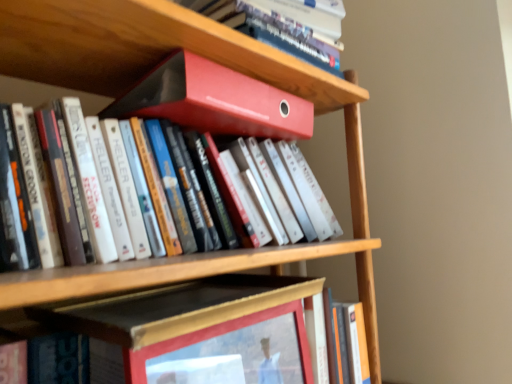
Describe the element at coordinates (143, 48) in the screenshot. This screenshot has width=512, height=384. I see `matte plastic file at upper center` at that location.

This screenshot has height=384, width=512. What do you see at coordinates (269, 30) in the screenshot?
I see `matte red folder at upper center, which is the fifth book from bottom to top` at bounding box center [269, 30].

Describe the element at coordinates (230, 352) in the screenshot. This screenshot has width=512, height=384. I see `wooden picture frame at center` at that location.

What is the approximate height of wooden picture frame at center?

wooden picture frame at center is 9.51 inches in height.

In order to click on matte red binder at upper center, arranged as the second book when viewed from the top in this screenshot , I will do `click(215, 101)`.

From a real-world perspective, which object rests below the other?

matte plastic file at upper center, from a real-world perspective.

Considering the sizes of objects matte red folder at upper center, which is the fifth book from bottom to top, and matte plastic file at upper center in the image provided, who is wider, matte red folder at upper center, which is the fifth book from bottom to top, or matte plastic file at upper center?

Wider between the two is matte red folder at upper center, which is the fifth book from bottom to top.

Which object is more forward, matte red folder at upper center, which is the fifth book from bottom to top, or matte plastic file at upper center?

matte plastic file at upper center is closer to the camera.

Is matte plastic file at upper center oriented away from matte red binder at upper center, the 3th book viewed from the top?

That's not correct — matte plastic file at upper center is not looking away from matte red binder at upper center, the 3th book viewed from the top.

Can you confirm if matte plastic file at upper center is thinner than matte red binder at upper center, the third book in the bottom-to-top sequence?

In fact, matte plastic file at upper center might be wider than matte red binder at upper center, the third book in the bottom-to-top sequence.

Who is shorter, matte plastic file at upper center or matte red binder at upper center, the 3th book viewed from the top?

matte plastic file at upper center.

Is matte plastic file at upper center outside of matte red binder at upper center, the third book in the bottom-to-top sequence?

matte plastic file at upper center lies outside matte red binder at upper center, the third book in the bottom-to-top sequence,'s area.

Based on their positions, is matte red binder at upper center, the 3th book viewed from the top, located to the left or right of matte red binder at upper center, arranged as the second book when viewed from the top?

matte red binder at upper center, the 3th book viewed from the top, is positioned on matte red binder at upper center, arranged as the second book when viewed from the top,'s left side.

Is matte red binder at upper center, the third book in the bottom-to-top sequence, turned away from matte red binder at upper center, the 4th book positioned from the bottom?

No.

Which of these two, matte red binder at upper center, the 3th book viewed from the top, or matte red binder at upper center, arranged as the second book when viewed from the top, is smaller?

matte red binder at upper center, arranged as the second book when viewed from the top, is smaller.

From the image's perspective, would you say matte red binder at upper center, the third book in the bottom-to-top sequence, is shown under matte red binder at upper center, arranged as the second book when viewed from the top?

Correct, matte red binder at upper center, the third book in the bottom-to-top sequence, appears lower than matte red binder at upper center, arranged as the second book when viewed from the top, in the image.

Is wooden picture frame at center aimed at matte red folder at upper center, which is the fifth book from bottom to top?

No.

Considering the positions of objects wooden picture frame at center and matte red folder at upper center, placed as the first book when sorted from top to bottom, in the image provided, who is in front, wooden picture frame at center or matte red folder at upper center, placed as the first book when sorted from top to bottom,?

wooden picture frame at center is closer to the camera.

Looking at their sizes, would you say wooden picture frame at center is wider or thinner than matte red folder at upper center, which is the fifth book from bottom to top?

wooden picture frame at center is thinner than matte red folder at upper center, which is the fifth book from bottom to top.

Between wooden picture frame at center and matte red folder at upper center, which is the fifth book from bottom to top, which one has more height?

Standing taller between the two is wooden picture frame at center.

Considering the positions of objects matte red binder at upper center, the 3th book viewed from the top, and matte plastic file at upper center in the image provided, who is more to the right, matte red binder at upper center, the 3th book viewed from the top, or matte plastic file at upper center?

Positioned to the right is matte plastic file at upper center.

From the image's perspective, which one is positioned lower, matte red binder at upper center, the 3th book viewed from the top, or matte plastic file at upper center?

matte red binder at upper center, the 3th book viewed from the top, from the image's perspective.

From a real-world perspective, is matte red binder at upper center, the third book in the bottom-to-top sequence, positioned above or below matte plastic file at upper center?

matte red binder at upper center, the third book in the bottom-to-top sequence, is situated lower than matte plastic file at upper center in the real world.

Is matte red binder at upper center, the third book in the bottom-to-top sequence, aimed at matte plastic file at upper center?

No, matte red binder at upper center, the third book in the bottom-to-top sequence, does not turn towards matte plastic file at upper center.

Can you see matte plastic file at upper center touching wooden picture frame at center?

matte plastic file at upper center is not next to wooden picture frame at center, and they're not touching.

Which of these two, matte plastic file at upper center or wooden picture frame at center, is wider?

Wider between the two is matte plastic file at upper center.

Is matte plastic file at upper center not inside wooden picture frame at center?

Indeed, matte plastic file at upper center is completely outside wooden picture frame at center.

Can you confirm if matte plastic file at upper center is smaller than wooden picture frame at center?

Incorrect, matte plastic file at upper center is not smaller in size than wooden picture frame at center.

Is matte red binder at upper center, the third book in the bottom-to-top sequence, closer to the viewer compared to orange matte book at lower right, which ranks as the first book in bottom-to-top order?

Yes, matte red binder at upper center, the third book in the bottom-to-top sequence, is closer to the viewer.

Is matte red binder at upper center, the 3th book viewed from the top, turned away from orange matte book at lower right, which ranks as the first book in bottom-to-top order?

matte red binder at upper center, the 3th book viewed from the top, does not have its back to orange matte book at lower right, which ranks as the first book in bottom-to-top order.

From a real-world perspective, is matte red binder at upper center, the third book in the bottom-to-top sequence, located higher than orange matte book at lower right, which ranks as the first book in bottom-to-top order?

Yes, from a real-world perspective, matte red binder at upper center, the third book in the bottom-to-top sequence, is over orange matte book at lower right, which ranks as the first book in bottom-to-top order

Identify the location of shelf below the matte red folder at upper center, which is the fifth book from bottom to top (from the image's perspective). (143, 48).

The image size is (512, 384). Identify the location of shelf behind the matte red binder at upper center, the third book in the bottom-to-top sequence. (143, 48).

Looking at the image, which one is located closer to wooden picture frame at center, matte red binder at upper center, arranged as the second book when viewed from the top, or matte black frame at center, the 4th book positioned from the top?

matte black frame at center, the 4th book positioned from the top.

Which object lies nearer to the anchor point matte plastic file at upper center, matte red binder at upper center, arranged as the second book when viewed from the top, or wooden picture frame at center?

matte red binder at upper center, arranged as the second book when viewed from the top.

When comparing their distances from matte black frame at center, the 4th book positioned from the top, does matte red binder at upper center, arranged as the second book when viewed from the top, or matte plastic file at upper center seem closer?

matte red binder at upper center, arranged as the second book when viewed from the top, is positioned closer to the anchor matte black frame at center, the 4th book positioned from the top.

Looking at the image, which one is located closer to matte red binder at upper center, the 4th book positioned from the bottom, matte red binder at upper center, the third book in the bottom-to-top sequence, or orange matte book at lower right, which ranks as the first book in bottom-to-top order?

Based on the image, matte red binder at upper center, the third book in the bottom-to-top sequence, appears to be nearer to matte red binder at upper center, the 4th book positioned from the bottom.

Based on their spatial positions, is matte red binder at upper center, the third book in the bottom-to-top sequence, or wooden picture frame at center further from matte plastic file at upper center?

wooden picture frame at center is further to matte plastic file at upper center.

When comparing their distances from matte red binder at upper center, arranged as the second book when viewed from the top, does orange matte book at lower right, which ranks as the first book in bottom-to-top order, or matte red binder at upper center, the third book in the bottom-to-top sequence, seem further?

Among the two, orange matte book at lower right, which ranks as the first book in bottom-to-top order, is located further to matte red binder at upper center, arranged as the second book when viewed from the top.

From the image, which object appears to be farther from orange matte book at lower right, which appears as the fifth book when viewed from the top, matte red binder at upper center, arranged as the second book when viewed from the top, or wooden picture frame at center?

Based on the image, matte red binder at upper center, arranged as the second book when viewed from the top, appears to be further to orange matte book at lower right, which appears as the fifth book when viewed from the top.

Considering their positions, is matte black frame at center, the 4th book positioned from the top, positioned further to orange matte book at lower right, which appears as the fifth book when viewed from the top, than matte plastic file at upper center?

matte plastic file at upper center.

I want to click on picture frame between matte red folder at upper center, which is the fifth book from bottom to top, and orange matte book at lower right, which ranks as the first book in bottom-to-top order, vertically, so click(230, 352).

Find the location of a particular element. shelf between matte red folder at upper center, placed as the first book when sorted from top to bottom, and matte black frame at center, the 4th book positioned from the top, vertically is located at coordinates (143, 48).

At what (x,y) coordinates should I click in order to perform the action: click on book between matte red binder at upper center, the 4th book positioned from the bottom, and matte black frame at center, arranged as the second book when ordered from the bottom, from top to bottom. Please return your answer as a coordinate pair (x, y). The width and height of the screenshot is (512, 384). Looking at the image, I should click on (170, 193).

This screenshot has width=512, height=384. What are the coordinates of `shelf between matte red folder at upper center, which is the fifth book from bottom to top, and wooden picture frame at center from top to bottom` in the screenshot? It's located at (143, 48).